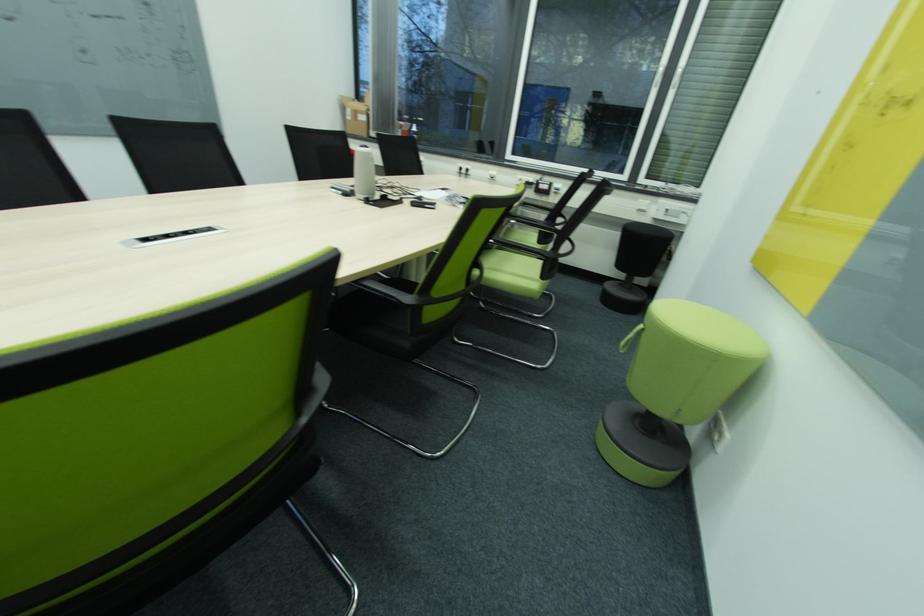
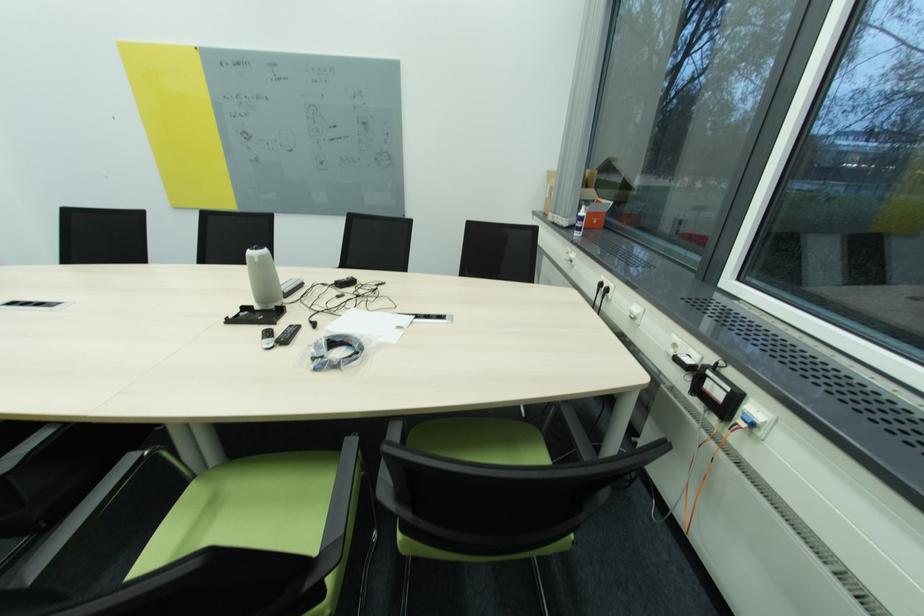
Where in the second image is the point corresponding to point (471, 172) from the first image?

(612, 291)